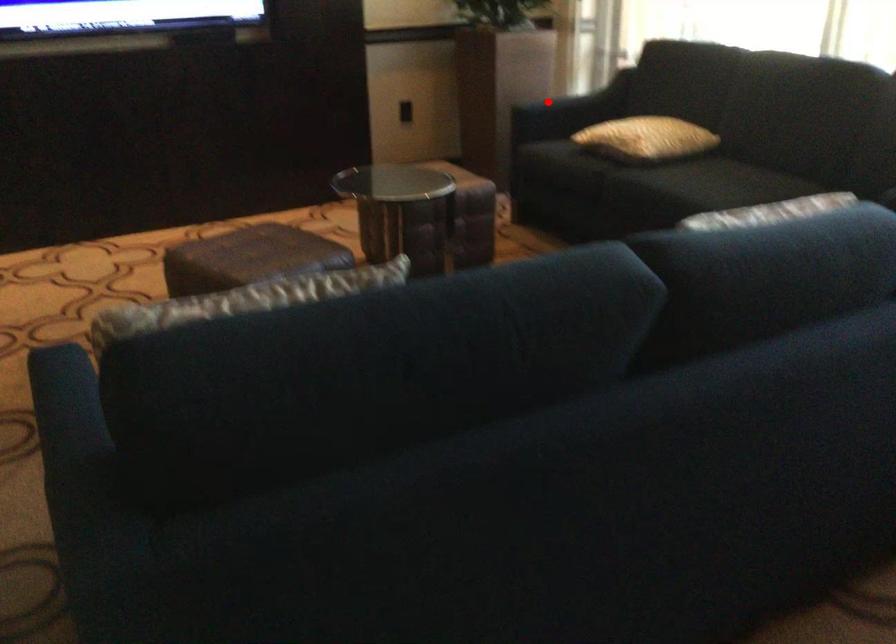
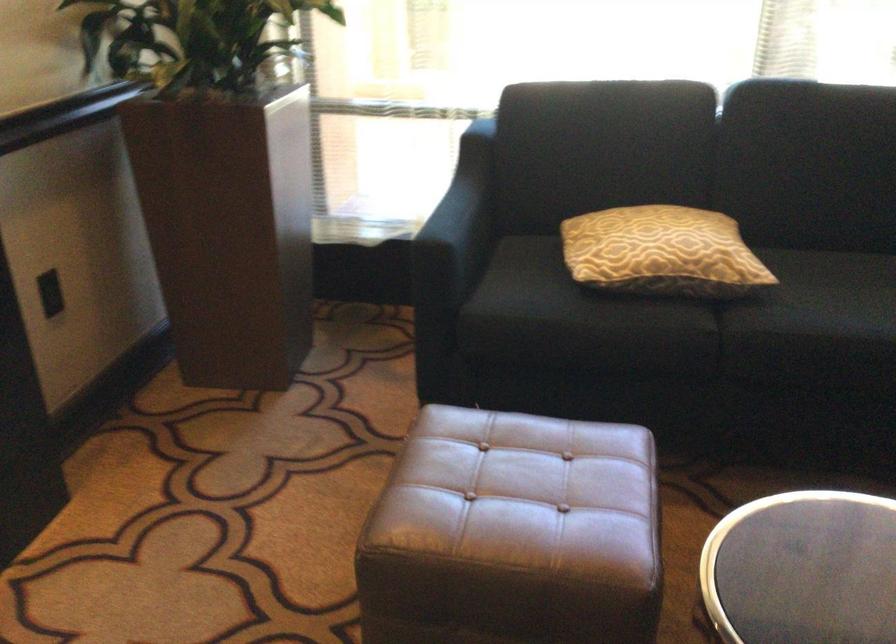
Find the pixel in the second image that matches the highlighted location in the first image.

(458, 225)